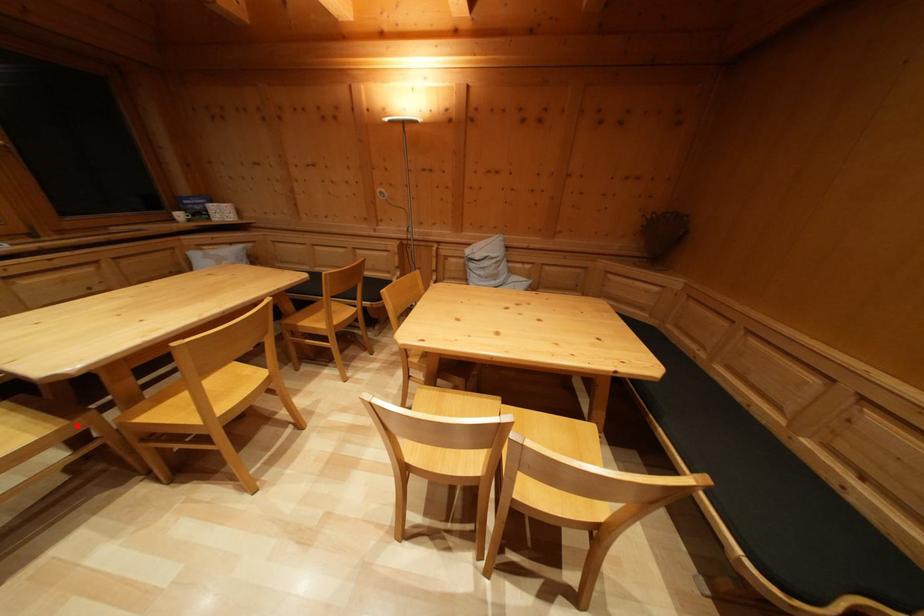
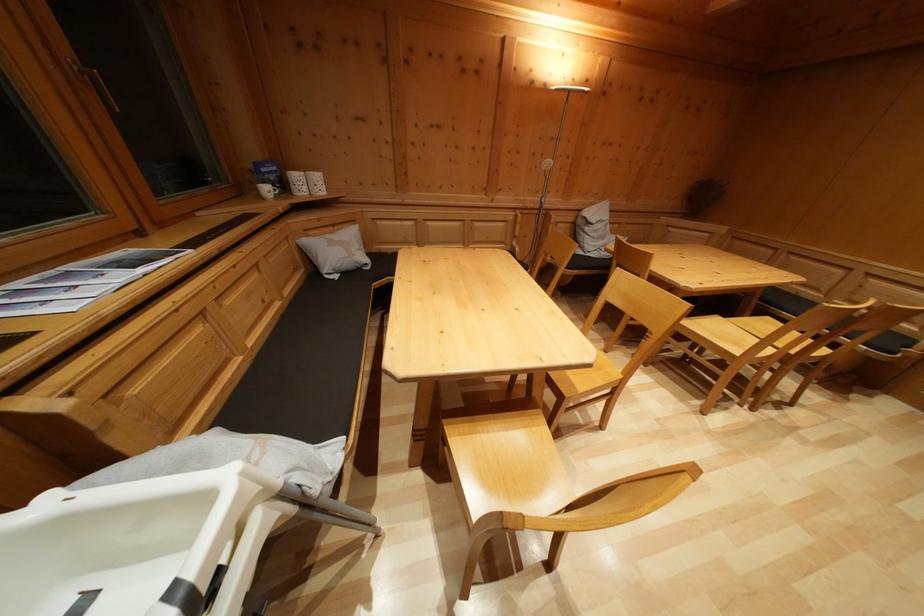
Question: I am providing you with two images of the same scene from different viewpoints. A red point is shown in image1. For the corresponding object point in image2, is it positioned nearer or farther from the camera?

Choices:
 (A) Nearer
 (B) Farther

Answer: (A)